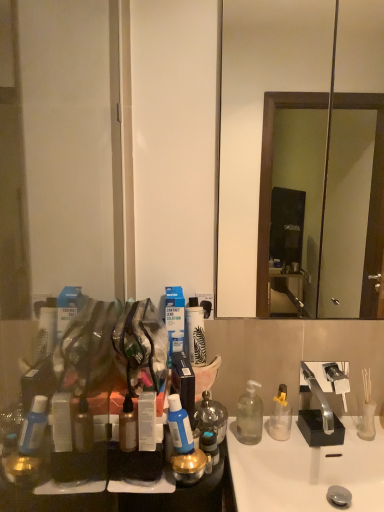
Question: Is clear plastic bottle at center, placed as the 4th bottle when sorted from left to right, completely or partially inside blue translucent bottle at center, which is the 2th bottle in front-to-back order?

Choices:
 (A) no
 (B) yes

Answer: (A)

Question: Is blue translucent bottle at center, positioned as the second bottle in left-to-right order, at the left side of clear plastic bottle at center, the 1th bottle when ordered from right to left?

Choices:
 (A) no
 (B) yes

Answer: (B)

Question: Considering the relative sizes of blue translucent bottle at center, which is the 2th bottle in front-to-back order, and clear plastic bottle at center, the 1th bottle when ordered from right to left, in the image provided, is blue translucent bottle at center, which is the 2th bottle in front-to-back order, bigger than clear plastic bottle at center, the 1th bottle when ordered from right to left,?

Choices:
 (A) yes
 (B) no

Answer: (B)

Question: From a real-world perspective, is blue translucent bottle at center, positioned as the second bottle in left-to-right order, over clear plastic bottle at center, placed as the 4th bottle when sorted from left to right?

Choices:
 (A) no
 (B) yes

Answer: (B)

Question: Considering the relative positions of blue translucent bottle at center, the 3th bottle in the back-to-front sequence, and clear plastic bottle at center, the first bottle when ordered from back to front, in the image provided, is blue translucent bottle at center, the 3th bottle in the back-to-front sequence, to the right of clear plastic bottle at center, the first bottle when ordered from back to front, from the viewer's perspective?

Choices:
 (A) yes
 (B) no

Answer: (B)

Question: Considering the positions of clear plastic bottle at center, placed as the 4th bottle when sorted from left to right, and wooden framed mirror at center in the image, is clear plastic bottle at center, placed as the 4th bottle when sorted from left to right, wider or thinner than wooden framed mirror at center?

Choices:
 (A) wide
 (B) thin

Answer: (A)

Question: Is point (286, 415) positioned closer to the camera than point (360, 74)?

Choices:
 (A) farther
 (B) closer

Answer: (B)

Question: From a real-world perspective, is clear plastic bottle at center, the 1th bottle when ordered from right to left, physically located above or below wooden framed mirror at center?

Choices:
 (A) below
 (B) above

Answer: (A)

Question: Would you say clear plastic bottle at center, placed as the 4th bottle when sorted from left to right, is to the left or to the right of wooden framed mirror at center in the picture?

Choices:
 (A) left
 (B) right

Answer: (A)

Question: From a real-world perspective, is wooden framed mirror at center positioned above or below clear plastic bottle at center, which ranks as the fourth bottle in front-to-back order?

Choices:
 (A) above
 (B) below

Answer: (A)

Question: Is wooden framed mirror at center spatially inside clear plastic bottle at center, the 1th bottle when ordered from right to left, or outside of it?

Choices:
 (A) inside
 (B) outside

Answer: (B)

Question: In the image, is wooden framed mirror at center on the left side or the right side of clear plastic bottle at center, which ranks as the fourth bottle in front-to-back order?

Choices:
 (A) right
 (B) left

Answer: (A)

Question: Is wooden framed mirror at center wider or thinner than clear plastic bottle at center, placed as the 4th bottle when sorted from left to right?

Choices:
 (A) wide
 (B) thin

Answer: (B)

Question: From a real-world perspective, is transparent plastic container at center positioned above or below clear plastic bottle at center, which ranks as the fourth bottle in front-to-back order?

Choices:
 (A) below
 (B) above

Answer: (B)

Question: Is point (137, 431) positioned closer to the camera than point (289, 430)?

Choices:
 (A) closer
 (B) farther

Answer: (A)